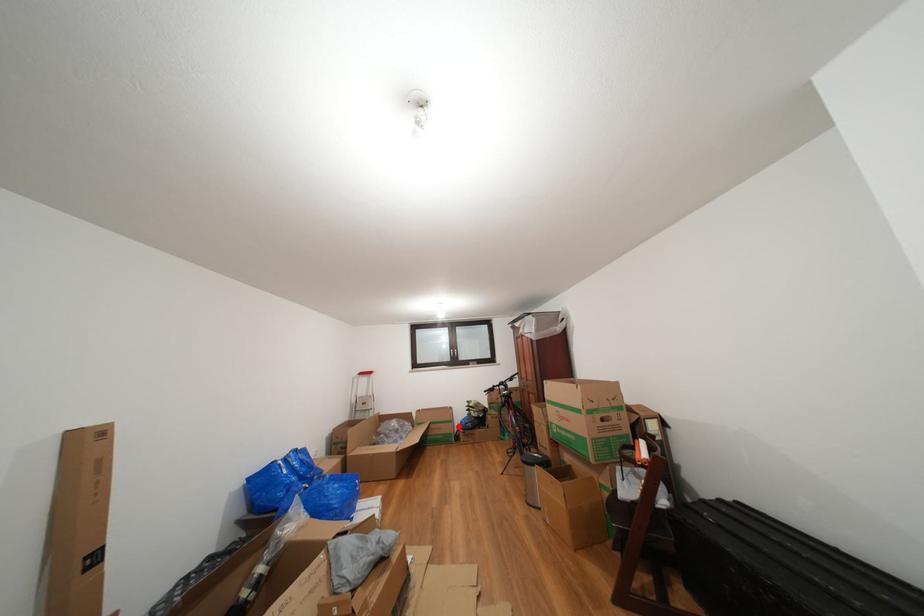
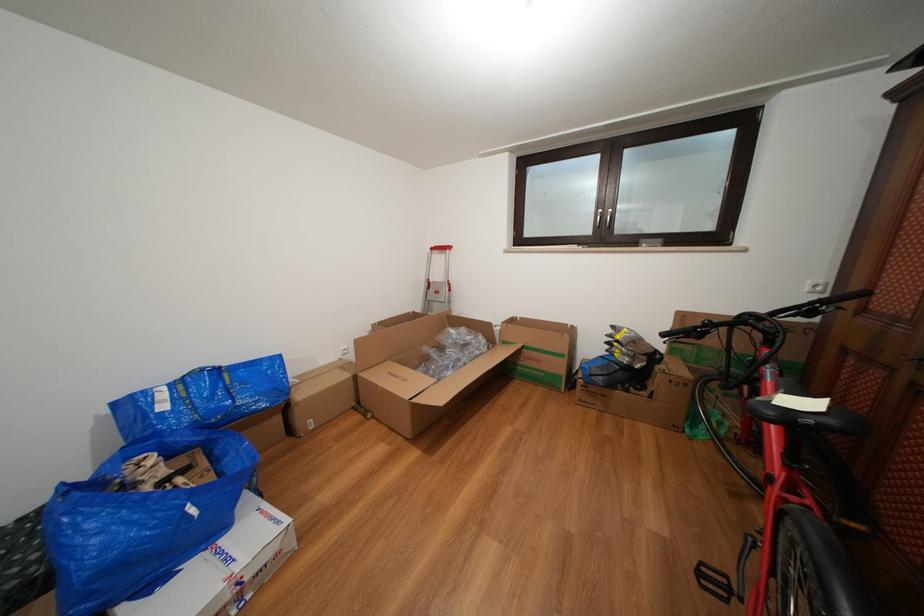
Where in the second image is the point corresponding to the highlighted location from the first image?

(570, 361)